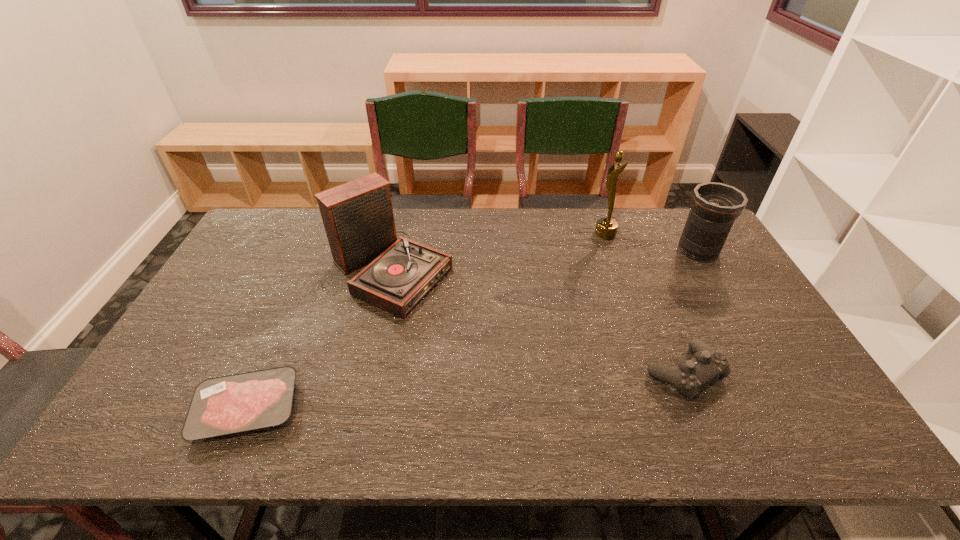
Locate an element on the screen. the tallest object is located at coordinates (606, 228).

At what (x,y) coordinates should I click in order to perform the action: click on the fourth shortest object. Please return your answer as a coordinate pair (x, y). Image resolution: width=960 pixels, height=540 pixels. Looking at the image, I should click on (358, 218).

The height and width of the screenshot is (540, 960). What are the coordinates of `the rightmost object` in the screenshot? It's located at (715, 206).

Find the location of `telephoto lens`. telephoto lens is located at coordinates (715, 206).

The width and height of the screenshot is (960, 540). I want to click on control, so click(x=707, y=365).

I want to click on the shortest object, so click(x=237, y=403).

At what (x,y) coordinates should I click in order to perform the action: click on vacant space located 0.400m on the front-facing side of the tallest object. Please return your answer as a coordinate pair (x, y). Looking at the image, I should click on (480, 234).

This screenshot has height=540, width=960. What are the coordinates of `vacant space located on the front-facing side of the tallest object` in the screenshot? It's located at (552, 234).

Where is `vacant space situated on the front-facing side of the tallest object`? Image resolution: width=960 pixels, height=540 pixels. vacant space situated on the front-facing side of the tallest object is located at coordinates (540, 234).

The height and width of the screenshot is (540, 960). Identify the location of vacant space located on the front of the second tallest object. (353, 438).